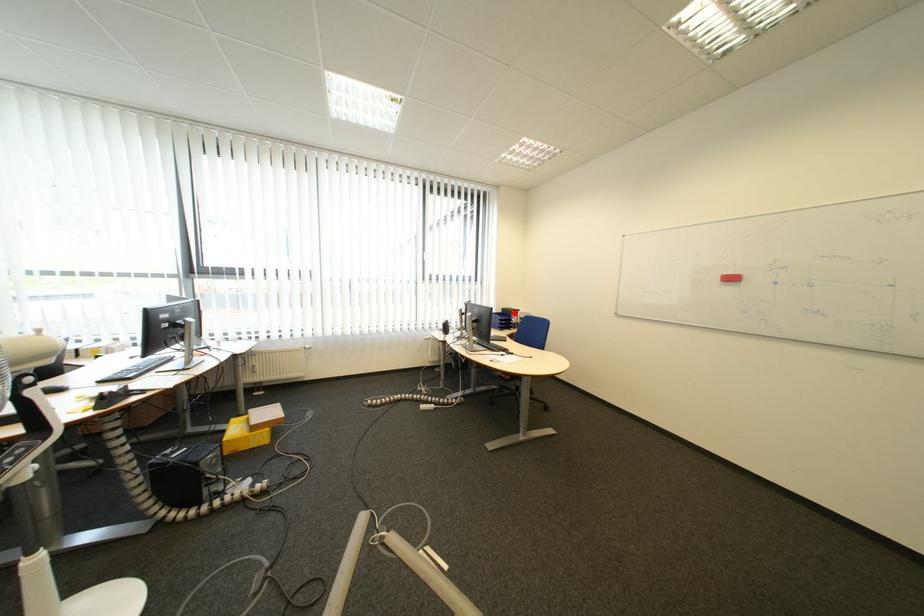
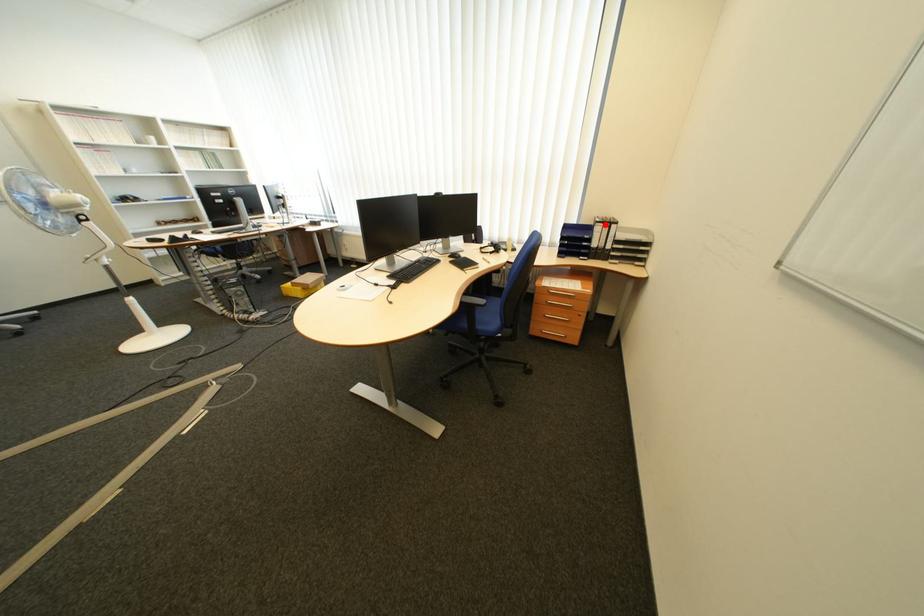
I am providing you with two images of the same scene from different viewpoints. A red point is marked on the first image and another point is marked on the second image. Is the red point in image1 aligned with the point shown in image2?

Yes